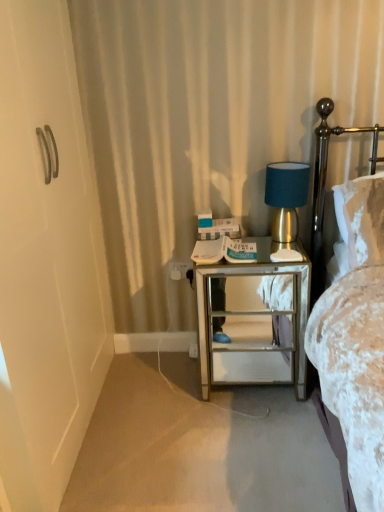
Question: Does carpet at lower left have a larger size compared to white plastic electric outlet at center?

Choices:
 (A) no
 (B) yes

Answer: (B)

Question: From the image's perspective, is carpet at lower left beneath white plastic electric outlet at center?

Choices:
 (A) yes
 (B) no

Answer: (A)

Question: Considering the relative positions of carpet at lower left and white plastic electric outlet at center in the image provided, is carpet at lower left behind white plastic electric outlet at center?

Choices:
 (A) no
 (B) yes

Answer: (A)

Question: Does carpet at lower left appear on the right side of white plastic electric outlet at center?

Choices:
 (A) yes
 (B) no

Answer: (A)

Question: Would you say white plastic electric outlet at center is part of carpet at lower left's contents?

Choices:
 (A) yes
 (B) no

Answer: (B)

Question: Could you tell me if carpet at lower left is facing white plastic electric outlet at center?

Choices:
 (A) yes
 (B) no

Answer: (B)

Question: From the image's perspective, is white plastic electric outlet at center located above carpet at lower left?

Choices:
 (A) no
 (B) yes

Answer: (B)

Question: Could you tell me if white plastic electric outlet at center is turned towards carpet at lower left?

Choices:
 (A) yes
 (B) no

Answer: (B)

Question: Can you confirm if white plastic electric outlet at center is positioned to the left of carpet at lower left?

Choices:
 (A) yes
 (B) no

Answer: (A)

Question: Considering the relative sizes of white plastic electric outlet at center and carpet at lower left in the image provided, is white plastic electric outlet at center smaller than carpet at lower left?

Choices:
 (A) no
 (B) yes

Answer: (B)

Question: Does white plastic electric outlet at center have a lesser width compared to carpet at lower left?

Choices:
 (A) yes
 (B) no

Answer: (A)

Question: Is carpet at lower left at the back of white plastic electric outlet at center?

Choices:
 (A) no
 (B) yes

Answer: (A)

Question: Is carpet at lower left at the left side of gold metallic table lamp at right?

Choices:
 (A) no
 (B) yes

Answer: (B)